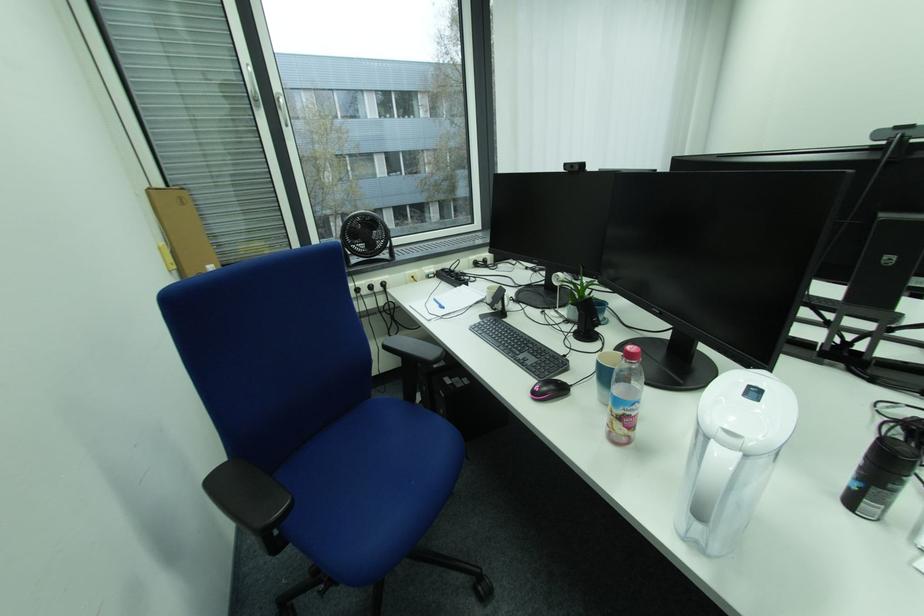
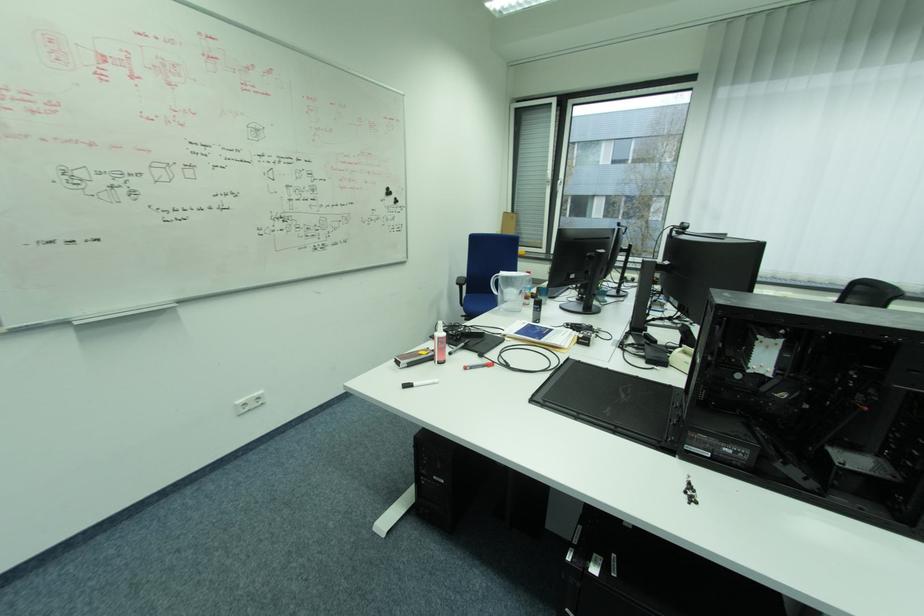
Question: I am providing you with two images of the same scene from different viewpoints. Which of the following objects are not visible in image2?

Choices:
 (A) white window handle
 (B) step stool handle
 (C) white marker
 (D) black round magnet

Answer: (A)